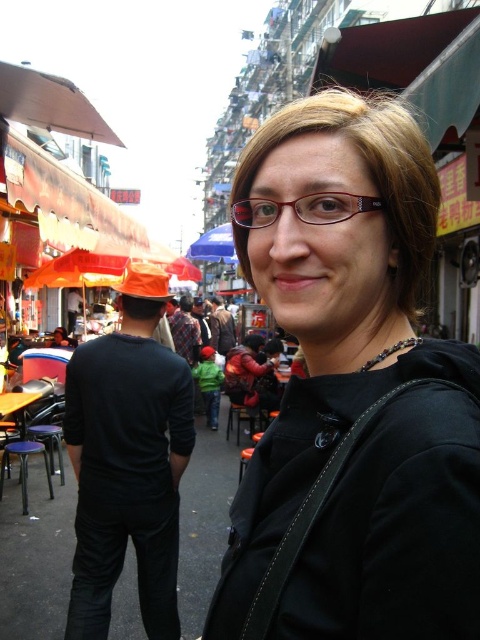
You are a photographer trying to capture a clear shot of the woman in the bustling street scene. Since the black matte shirt at center and the matte red glasses at center are both in the frame, which object should you focus on to ensure the subject is properly centered and in focus?

The black matte shirt at center has a greater height compared to the matte red glasses at center, so focusing on the black matte shirt at center will ensure the subject is properly centered and in focus.

Based on the photo, you are a photographer trying to capture the woman taking a selfie in the bustling street scene. The scene has a matte red glasses at center and a blue fabric umbrella at center. Which object is providing shade to the other?

The blue fabric umbrella at center is positioned above the matte red glasses at center, so it is providing shade to the matte red glasses at center.

The woman in the scene is wearing a black matte shirt at center and matte red glasses at center. Which item is positioned lower on her body?

The black matte shirt at center is located below matte red glasses at center, so the black matte shirt at center is positioned lower on her body.